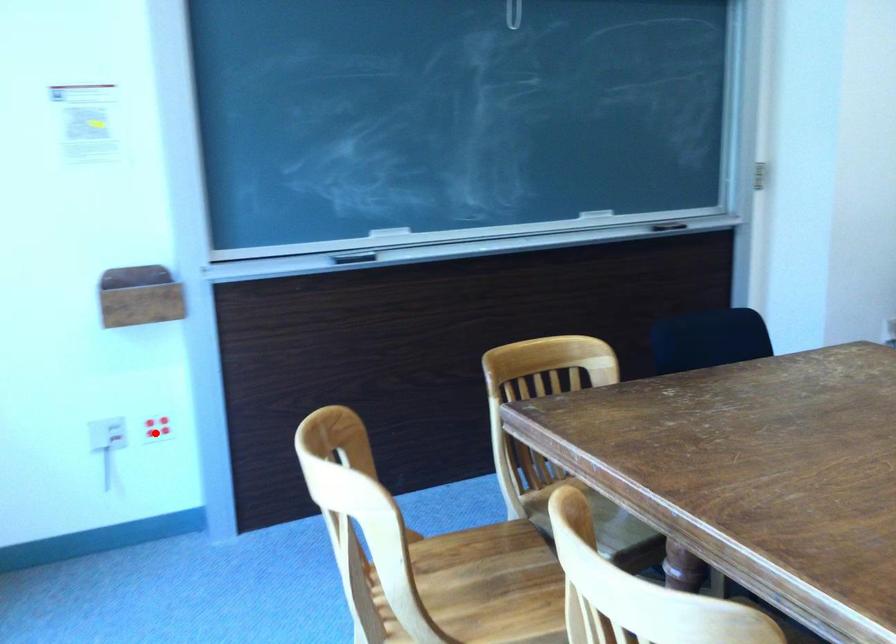
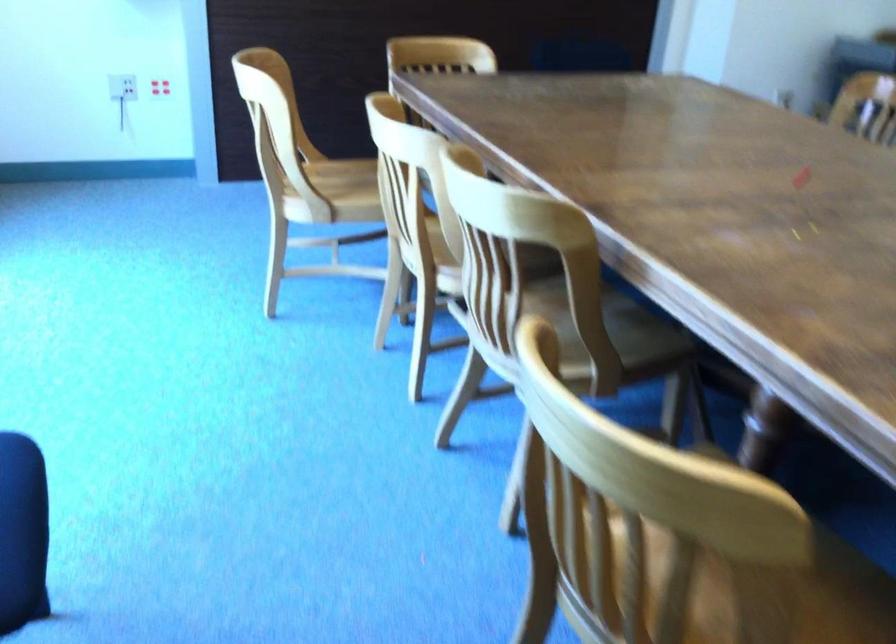
Question: I am providing you with two images of the same scene from different viewpoints. Given a red point in image1, look at the same physical point in image2. Is it:

Choices:
 (A) Closer to the viewpoint
 (B) Farther from the viewpoint

Answer: (B)